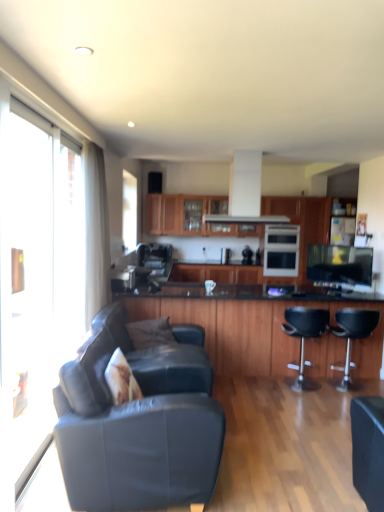
Question: From a real-world perspective, is white sheer curtain at left above or below black leather bar stool at center, positioned as the first chair in right-to-left order?

Choices:
 (A) above
 (B) below

Answer: (A)

Question: Considering the positions of white sheer curtain at left and black leather bar stool at center, positioned as the first chair in right-to-left order, in the image, is white sheer curtain at left wider or thinner than black leather bar stool at center, positioned as the first chair in right-to-left order,?

Choices:
 (A) wide
 (B) thin

Answer: (B)

Question: Which is farther from the white glossy oven at center?

Choices:
 (A) leather couch at lower left
 (B) black leather bar stool at center, arranged as the second chair when viewed from the left
 (C) transparent glass window at left
 (D) leather couch at lower left
 (E) wooden cabinet at center, which appears as the second cabinetry when viewed from the front

Answer: (A)

Question: Which of these objects is positioned closest to the leather couch at lower left?

Choices:
 (A) white textured pillow at lower left, placed as the first pillow when sorted from front to back
 (B) black leather bar stool at center right, acting as the first chair starting from the left
 (C) transparent glass screen door at left
 (D) gray fabric pillow at center, which is the first pillow in back-to-front order
 (E) wooden cabinet at center, arranged as the second cabinetry when viewed from the back

Answer: (A)